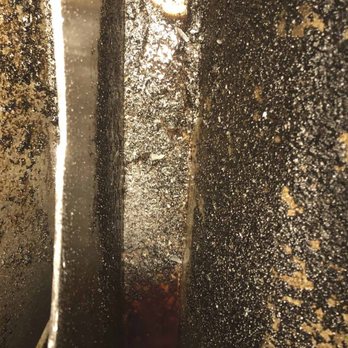
The width and height of the screenshot is (348, 348). Find the location of `center wall`. center wall is located at coordinates (163, 126).